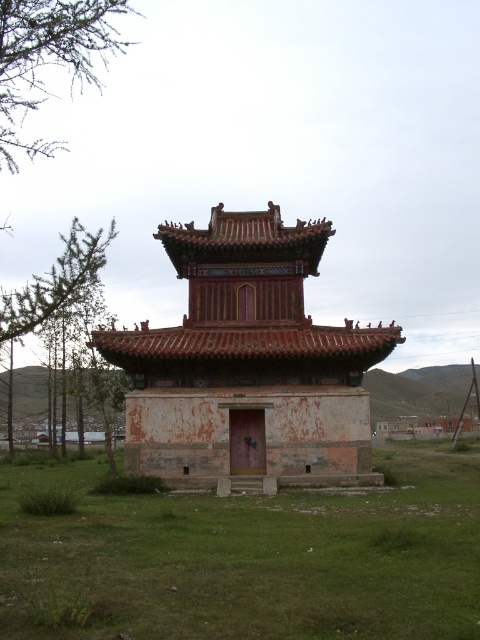
From the picture: Is green grass at center further to the viewer compared to green leafy tree at left?

No.

Does green grass at center appear on the right side of green leafy tree at left?

Correct, you'll find green grass at center to the right of green leafy tree at left.

Is point (364, 509) behind point (63, 236)?

No, (364, 509) is closer to viewer.

Locate an element on the screen. This screenshot has width=480, height=640. green grass at center is located at coordinates (247, 557).

Between rusty wood pagoda at center and green leafy tree at upper left, which one has more height?

Standing taller between the two is green leafy tree at upper left.

Does rusty wood pagoda at center have a lesser height compared to green leafy tree at upper left?

Indeed, rusty wood pagoda at center has a lesser height compared to green leafy tree at upper left.

I want to click on rusty wood pagoda at center, so click(248, 362).

Is green grass at center thinner than rusty wood pagoda at center?

Incorrect, green grass at center's width is not less than rusty wood pagoda at center's.

Is green grass at center shorter than rusty wood pagoda at center?

Yes, green grass at center is shorter than rusty wood pagoda at center.

Is point (40, 570) closer to viewer compared to point (278, 317)?

Yes, it is.

Where is `green grass at center`? This screenshot has height=640, width=480. green grass at center is located at coordinates (247, 557).